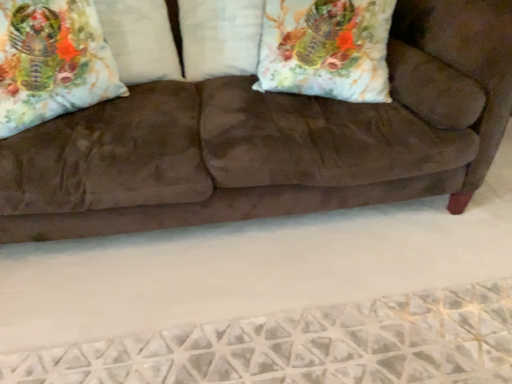
Question: From a real-world perspective, is brown suede couch at center physically above satin white pillow at center, marked as the first pillow in a right-to-left arrangement?

Choices:
 (A) no
 (B) yes

Answer: (A)

Question: Is satin white pillow at center, marked as the first pillow in a right-to-left arrangement, surrounded by brown suede couch at center?

Choices:
 (A) no
 (B) yes

Answer: (B)

Question: Is satin white pillow at center, marked as the second pillow in a left-to-right arrangement, at the back of brown suede couch at center?

Choices:
 (A) yes
 (B) no

Answer: (A)

Question: Is brown suede couch at center oriented towards satin white pillow at center, marked as the second pillow in a left-to-right arrangement?

Choices:
 (A) no
 (B) yes

Answer: (B)

Question: Considering the relative sizes of brown suede couch at center and satin white pillow at center, marked as the second pillow in a left-to-right arrangement, in the image provided, is brown suede couch at center shorter than satin white pillow at center, marked as the second pillow in a left-to-right arrangement,?

Choices:
 (A) yes
 (B) no

Answer: (B)

Question: Based on their positions, is satin white pillow at center, marked as the second pillow in a left-to-right arrangement, located to the left or right of brown suede couch at center?

Choices:
 (A) right
 (B) left

Answer: (A)

Question: Considering their positions, is satin white pillow at center, marked as the second pillow in a left-to-right arrangement, located in front of or behind brown suede couch at center?

Choices:
 (A) front
 (B) behind

Answer: (B)

Question: Does point (184, 18) appear closer or farther from the camera than point (228, 84)?

Choices:
 (A) closer
 (B) farther

Answer: (B)

Question: Is satin white pillow at center, marked as the first pillow in a right-to-left arrangement, inside or outside of brown suede couch at center?

Choices:
 (A) inside
 (B) outside

Answer: (A)

Question: Looking at the image, does brown suede couch at center seem bigger or smaller compared to satin white pillow at center, marked as the second pillow in a left-to-right arrangement?

Choices:
 (A) small
 (B) big

Answer: (B)

Question: Does point (404, 178) appear closer or farther from the camera than point (248, 34)?

Choices:
 (A) farther
 (B) closer

Answer: (B)

Question: From the image's perspective, relative to satin white pillow at center, marked as the first pillow in a right-to-left arrangement, is brown suede couch at center above or below?

Choices:
 (A) above
 (B) below

Answer: (B)

Question: Visually, is brown suede couch at center positioned to the left or to the right of satin white pillow at center, marked as the second pillow in a left-to-right arrangement?

Choices:
 (A) left
 (B) right

Answer: (A)

Question: Is floral fabric pillow at upper left, the second pillow in the right-to-left sequence, inside the boundaries of brown suede couch at center, or outside?

Choices:
 (A) outside
 (B) inside

Answer: (B)

Question: Does point (115, 46) appear closer or farther from the camera than point (192, 196)?

Choices:
 (A) closer
 (B) farther

Answer: (B)